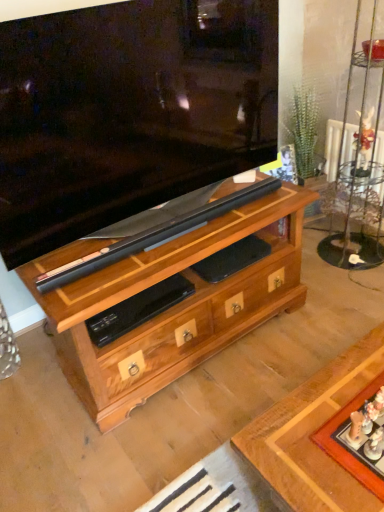
Question: From the image's perspective, is wooden board game at lower right above or below wooden chest of drawers at center?

Choices:
 (A) below
 (B) above

Answer: (A)

Question: Visually, is wooden board game at lower right positioned to the left or to the right of wooden chest of drawers at center?

Choices:
 (A) left
 (B) right

Answer: (B)

Question: In terms of size, does wooden board game at lower right appear bigger or smaller than wooden chest of drawers at center?

Choices:
 (A) big
 (B) small

Answer: (B)

Question: Considering the positions of wooden chest of drawers at center and wooden board game at lower right in the image, is wooden chest of drawers at center bigger or smaller than wooden board game at lower right?

Choices:
 (A) small
 (B) big

Answer: (B)

Question: Is point (215, 300) positioned closer to the camera than point (359, 471)?

Choices:
 (A) farther
 (B) closer

Answer: (A)

Question: In terms of height, does wooden chest of drawers at center look taller or shorter compared to wooden board game at lower right?

Choices:
 (A) tall
 (B) short

Answer: (A)

Question: Considering the positions of wooden chest of drawers at center and wooden board game at lower right in the image, is wooden chest of drawers at center wider or thinner than wooden board game at lower right?

Choices:
 (A) wide
 (B) thin

Answer: (A)